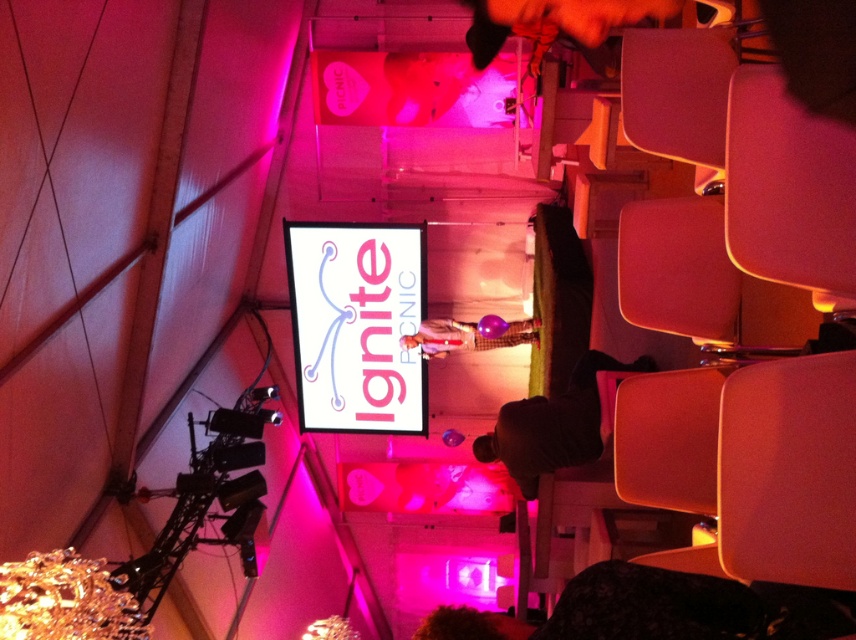
You are organizing a photo shoot and need to place a small tripod between the dark brown leather jacket at lower center and the matte purple balloon at center. Since the jacket is narrower than the balloon, will the tripod fit between them without touching either object?

The dark brown leather jacket at lower center has a lesser width compared to matte purple balloon at center, so the tripod can fit between them as there is enough space between the narrower jacket and the wider balloon.

You are an event organizer who needs to adjust the layout of the white plastic sign at center and the dark brown leather jacket at lower center. Which object is located to the left of the other?

The white plastic sign at center is positioned on the left side of dark brown leather jacket at lower center, so the white plastic sign at center is to the left of the dark brown leather jacket at lower center.

You are organizing a photo shoot and need to place a 1.5 meter long camera dolly track between the dark brown leather jacket at lower center and the matte purple balloon at center. Is there enough space to fit the track between them?

The dark brown leather jacket at lower center and the matte purple balloon at center are 1.38 meters apart, so the 1.5 meter long camera dolly track cannot fit between them as the distance is shorter than the track length.